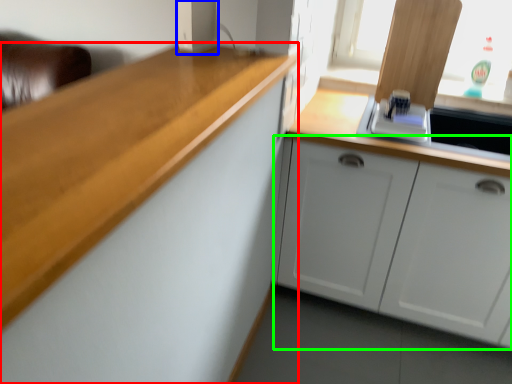
Question: Which is nearer to the cabinetry (highlighted by a red box)? appliance (highlighted by a blue box) or cabinetry (highlighted by a green box).

Choices:
 (A) appliance
 (B) cabinetry

Answer: (A)